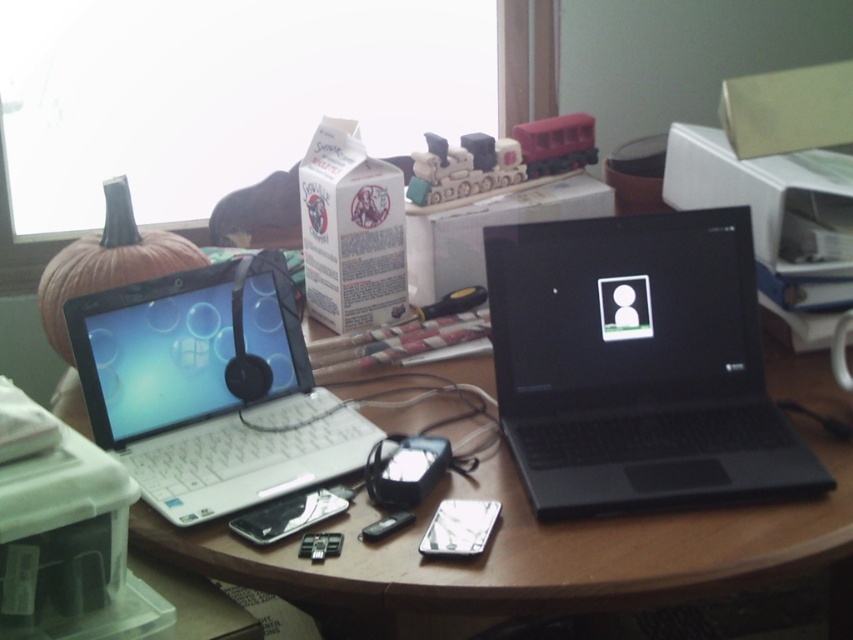
Question: Can you confirm if black matte laptop at center is positioned to the left of white glossy round table at center?

Choices:
 (A) yes
 (B) no

Answer: (B)

Question: Is black matte laptop at center further to camera compared to white plastic laptop at left?

Choices:
 (A) yes
 (B) no

Answer: (A)

Question: Considering the real-world distances, which object is closest to the black matte laptop at center?

Choices:
 (A) white plastic laptop at left
 (B) white glossy round table at center

Answer: (B)

Question: Does black matte laptop at center appear under white glossy round table at center?

Choices:
 (A) yes
 (B) no

Answer: (B)

Question: Which of these objects is positioned closest to the black matte laptop at center?

Choices:
 (A) white plastic laptop at left
 (B) white glossy round table at center

Answer: (B)

Question: Estimate the real-world distances between objects in this image. Which object is farther from the white glossy round table at center?

Choices:
 (A) black matte laptop at center
 (B) white plastic laptop at left

Answer: (B)